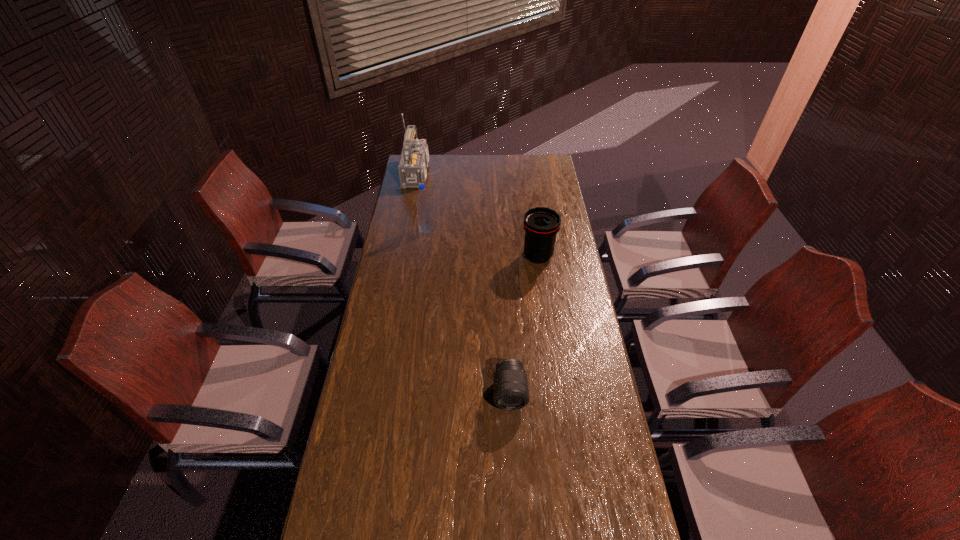
The height and width of the screenshot is (540, 960). I want to click on vacant space located on the surface of the nearer telephoto lens, so click(514, 472).

Locate an element on the screen. The image size is (960, 540). object present at the far edge is located at coordinates (414, 159).

Where is `radio receiver present at the left edge`? The width and height of the screenshot is (960, 540). radio receiver present at the left edge is located at coordinates (414, 159).

Where is `water bottle at the left edge`? water bottle at the left edge is located at coordinates (424, 212).

Find the location of a particular element. The image size is (960, 540). object positioned at the right edge is located at coordinates (541, 224).

Image resolution: width=960 pixels, height=540 pixels. I want to click on object present at the far left corner, so click(414, 159).

Where is `blank space at the far edge of the desktop`? The width and height of the screenshot is (960, 540). blank space at the far edge of the desktop is located at coordinates (486, 173).

In the image, there is a desktop. At what (x,y) coordinates should I click in order to perform the action: click on free space at the left edge. Please return your answer as a coordinate pair (x, y). The height and width of the screenshot is (540, 960). Looking at the image, I should click on pos(377,335).

Where is `free region at the right edge`? This screenshot has height=540, width=960. free region at the right edge is located at coordinates (583, 354).

Locate an element on the screen. vacant space at the far right corner of the desktop is located at coordinates (542, 173).